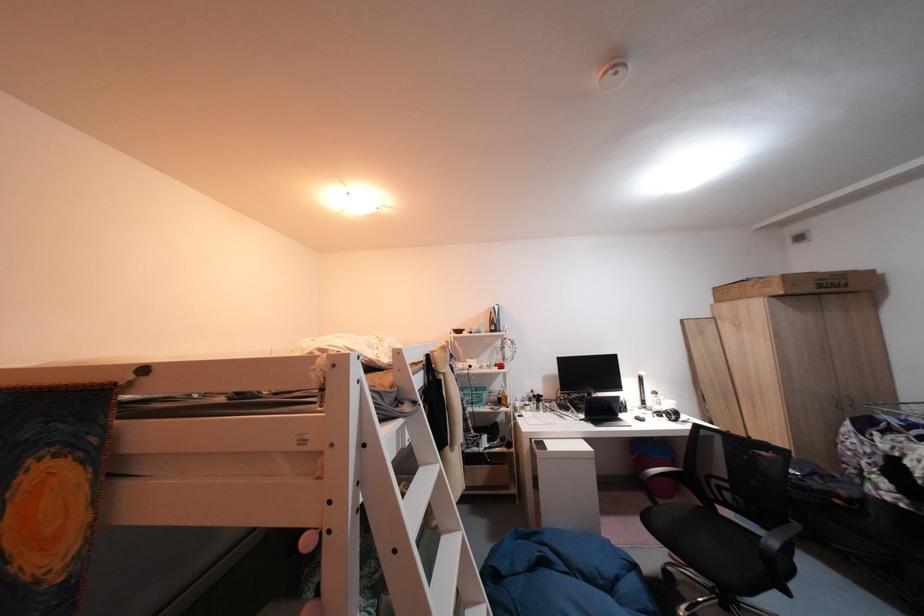
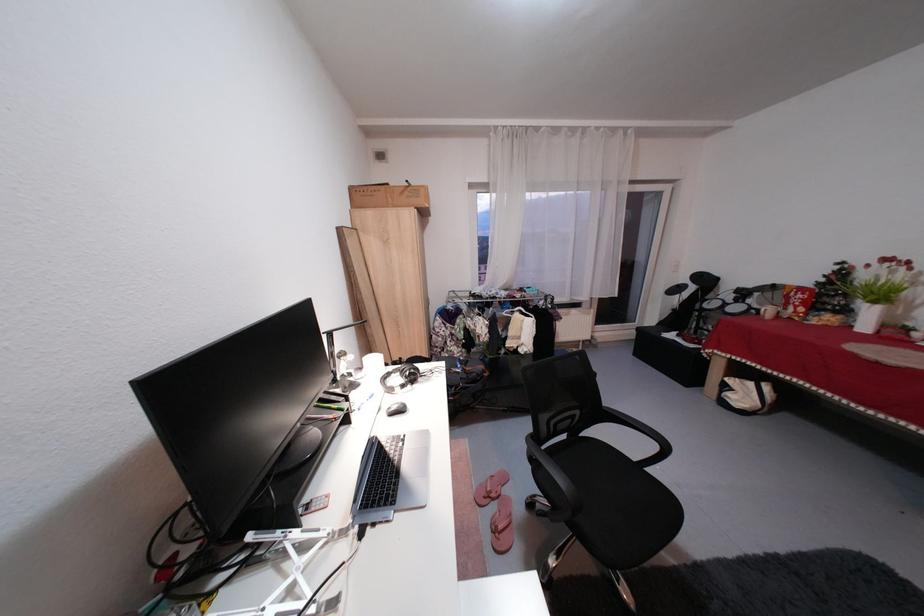
Question: I am providing you with two images of the same scene from different viewpoints. Please identify which objects are invisible in image2.

Choices:
 (A) silver headphones
 (B) pink flip-flop
 (C) wall flush button
 (D) black headphones

Answer: (D)